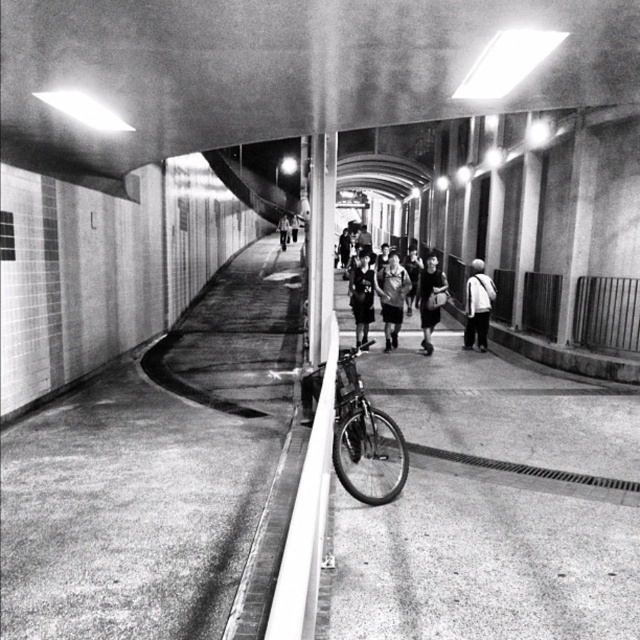
Which is more to the left, white fabric bag at center or dark gray fabric jacket at center?

Positioned to the left is dark gray fabric jacket at center.

Describe the element at coordinates (477, 305) in the screenshot. I see `white fabric bag at center` at that location.

Is point (474, 321) positioned behind point (352, 284)?

Yes.

Where is `white fabric bag at center`? white fabric bag at center is located at coordinates (x=477, y=305).

Is shiny metallic bicycle at center below dark gray fabric jacket at center?

Indeed, shiny metallic bicycle at center is positioned under dark gray fabric jacket at center.

Which is above, shiny metallic bicycle at center or dark gray fabric jacket at center?

dark gray fabric jacket at center is higher up.

Identify the location of shiny metallic bicycle at center. This screenshot has width=640, height=640. (364, 436).

Is the position of shiny metallic bicycle at center more distant than that of dark gray uniform at center?

That is False.

From the picture: Does shiny metallic bicycle at center have a greater width compared to dark gray uniform at center?

Yes, shiny metallic bicycle at center is wider than dark gray uniform at center.

Where is `shiny metallic bicycle at center`? Image resolution: width=640 pixels, height=640 pixels. shiny metallic bicycle at center is located at coordinates (364, 436).